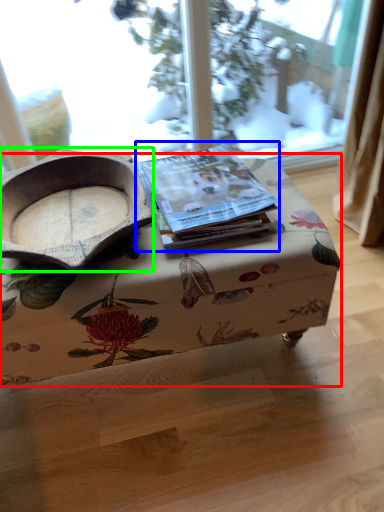
Question: Based on their relative distances, which object is nearer to table (highlighted by a red box)? Choose from paperback book (highlighted by a blue box) and bowl (highlighted by a green box).

Choices:
 (A) paperback book
 (B) bowl

Answer: (A)